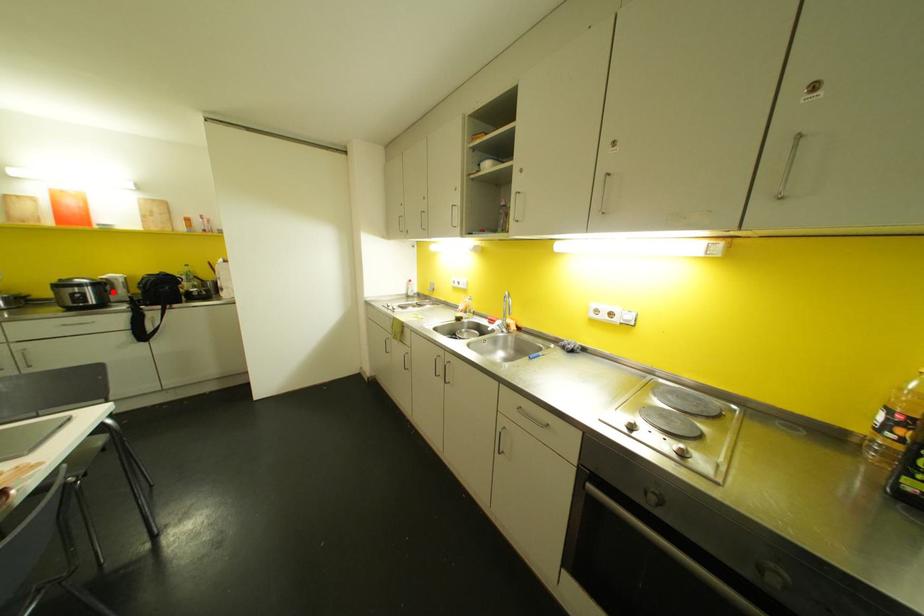
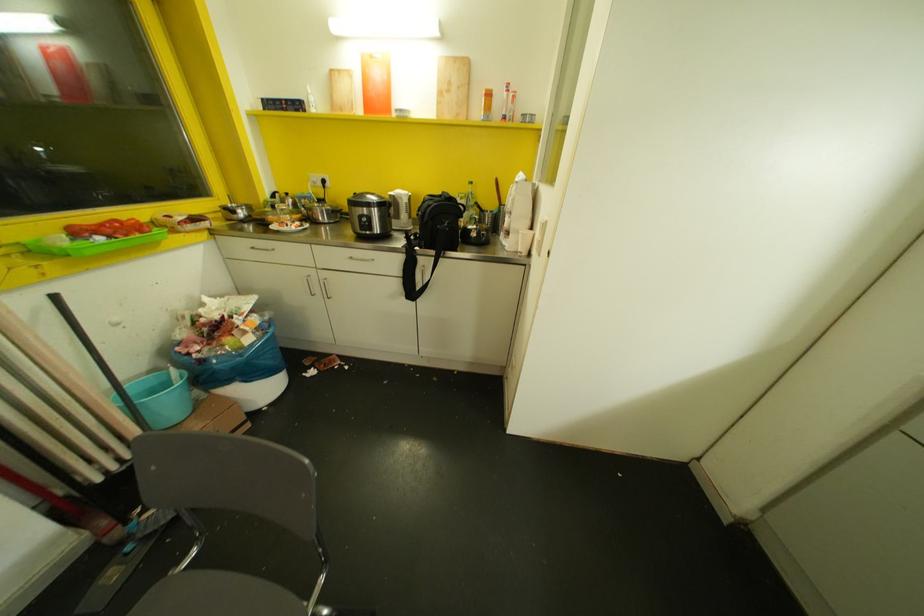
Question: I am providing you with two images of the same scene from different viewpoints. Image1 has a red point marked. In image2, the corresponding 3D location appears at what relative position? Reply with the corresponding letter.

Choices:
 (A) Closer
 (B) Farther

Answer: (A)